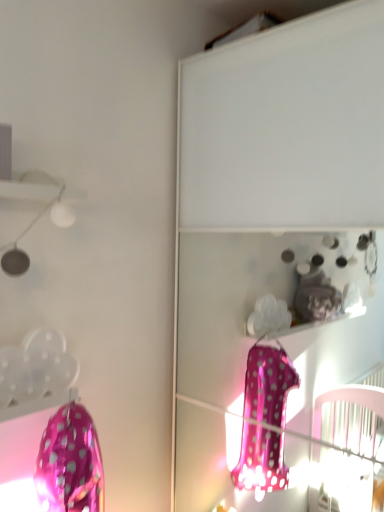
Find the location of `pink metallic balloon at lower left`. pink metallic balloon at lower left is located at coordinates (70, 463).

Describe the element at coordinates (70, 463) in the screenshot. I see `pink metallic balloon at lower left` at that location.

Measure the distance between pink metallic balloon at lower left and camera.

A distance of 96.37 centimeters exists between pink metallic balloon at lower left and camera.

What is the approximate height of pink metallic balloon at lower left?

The height of pink metallic balloon at lower left is 12.22 inches.

Locate an element on the screen. The width and height of the screenshot is (384, 512). pink metallic balloon at lower left is located at coordinates (70, 463).